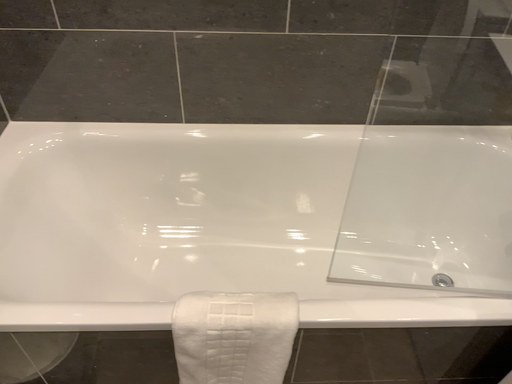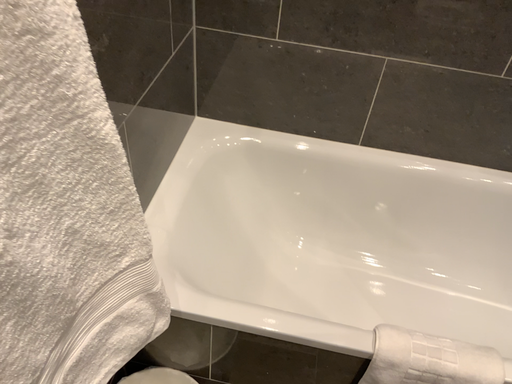
Question: How did the camera likely rotate when shooting the video?

Choices:
 (A) rotated right
 (B) rotated left

Answer: (B)